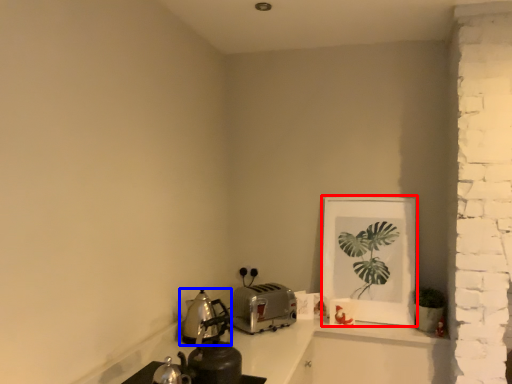
Question: Which object appears farthest to the camera in this image, picture frame (highlighted by a red box) or kitchen appliance (highlighted by a blue box)?

Choices:
 (A) picture frame
 (B) kitchen appliance

Answer: (A)